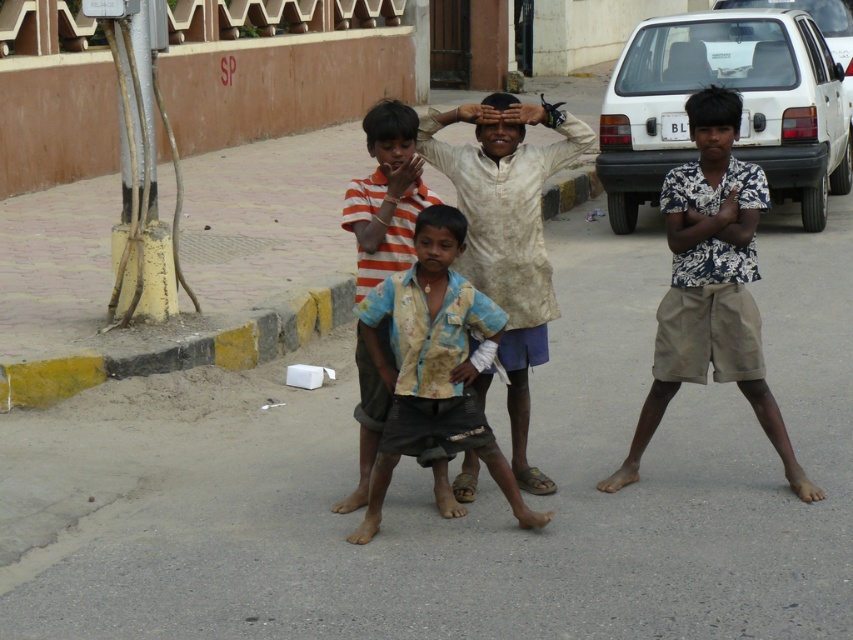
You are a photographer trying to capture a photo of the children. You notice two shirts in the scene, the printed cotton shirt at center and the light beige fabric shirt at center. Which shirt is positioned higher in the image?

The printed cotton shirt at center is above the light beige fabric shirt at center, so the printed cotton shirt at center is positioned higher in the image.

Where is the striped cotton shirt at center located in the image?

The striped cotton shirt at center is located at point (386, 195).

You are a photographer trying to capture a group photo of the striped cotton shirt at center and the white matte car at upper right. Which object takes up more space in the photo?

The white matte car at upper right takes up more space in the photo because the striped cotton shirt at center occupies less space than the white matte car at upper right.